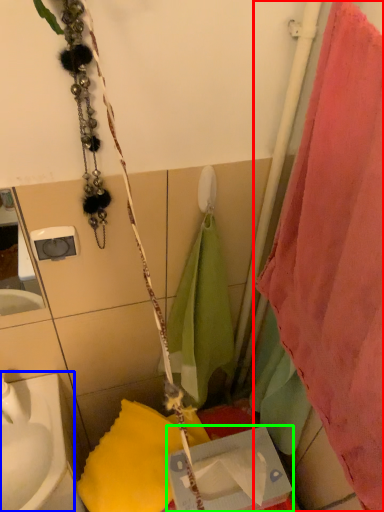
Question: Estimate the real-world distances between objects in this image. Which object is farther from curtain (highlighted by a red box), sink (highlighted by a blue box) or box (highlighted by a green box)?

Choices:
 (A) sink
 (B) box

Answer: (A)